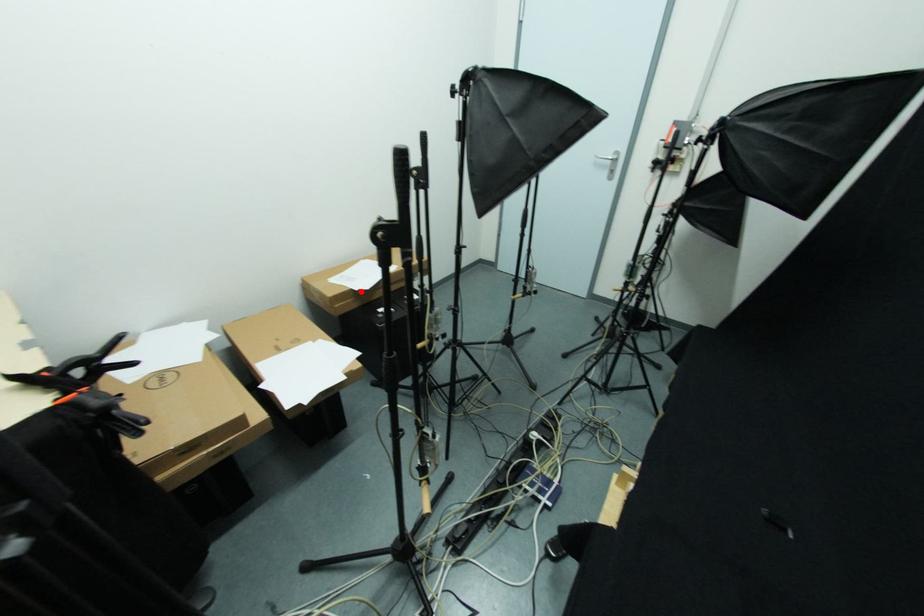
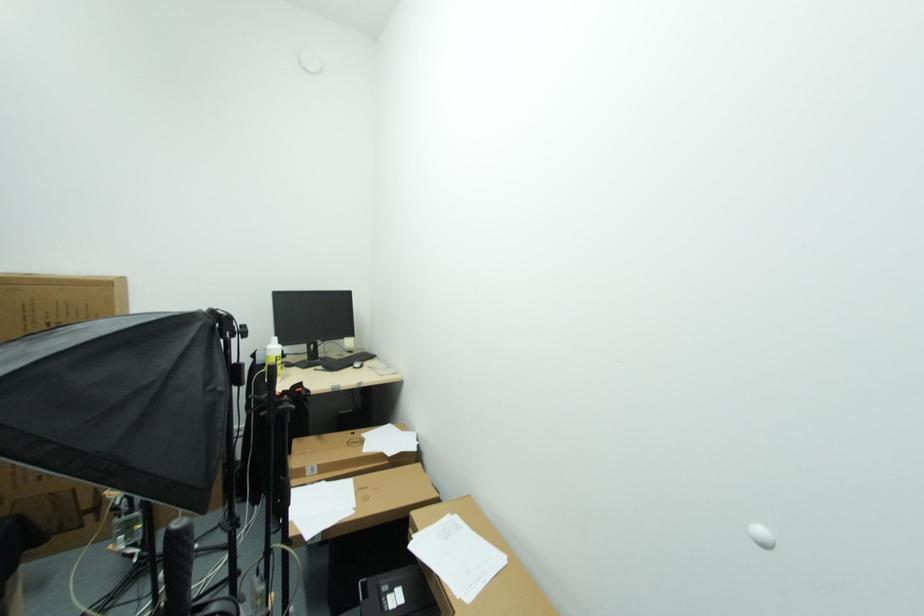
Where in the second image is the point corresponding to the highlighted location from the first image?

(414, 541)